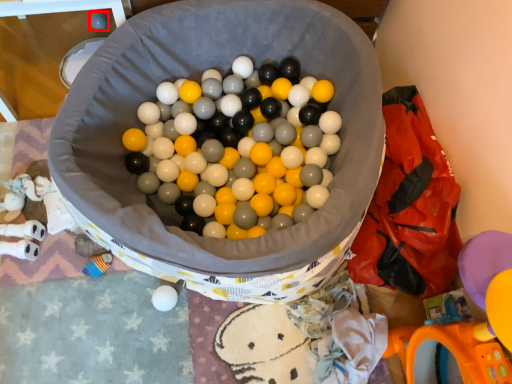
Question: From the image, what is the correct spatial relationship of toy (annotated by the red box) in relation to material?

Choices:
 (A) left
 (B) right

Answer: (A)